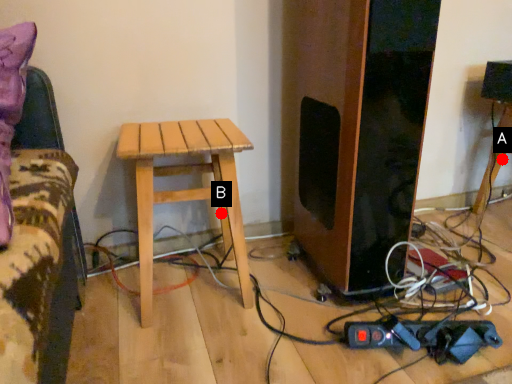
Question: Two points are circled on the image, labeled by A and B beside each circle. Which point is closer to the camera?

Choices:
 (A) A is closer
 (B) B is closer

Answer: (B)